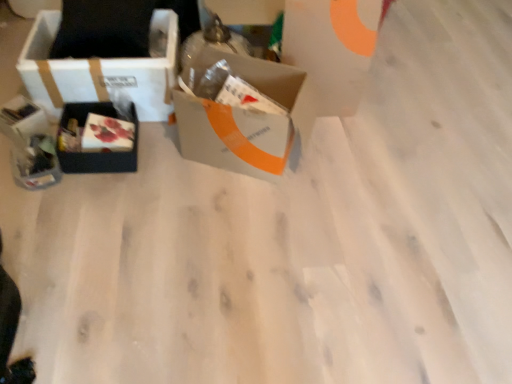
Question: Is matte black box at left, which is counted as the second box, starting from the right, spatially inside matte plastic box at center-left, or outside of it?

Choices:
 (A) outside
 (B) inside

Answer: (A)

Question: Considering the positions of matte black box at left, which is counted as the second box, starting from the right, and matte plastic box at center-left in the image, is matte black box at left, which is counted as the second box, starting from the right, wider or thinner than matte plastic box at center-left?

Choices:
 (A) thin
 (B) wide

Answer: (B)

Question: Based on their relative distances, which object is farther from the matte black gift box at left, the 1th gift box from the top?

Choices:
 (A) matte plastic box at center-left
 (B) white cardboard box at left, the third box when ordered from right to left
 (C) white cardboard box at upper center
 (D) matte black box at left, the second box viewed from the left
 (E) gray cardboard box at center, the first box positioned from the right

Answer: (C)

Question: Which object is positioned closest to the white cardboard box at upper center?

Choices:
 (A) white cardboard box at left, the third box when ordered from right to left
 (B) matte plastic box at center-left
 (C) matte black box at left, which is counted as the second box, starting from the right
 (D) matte black gift box at left, the second gift box viewed from the top
 (E) gray cardboard box at center, which is counted as the 3th box, starting from the left

Answer: (E)